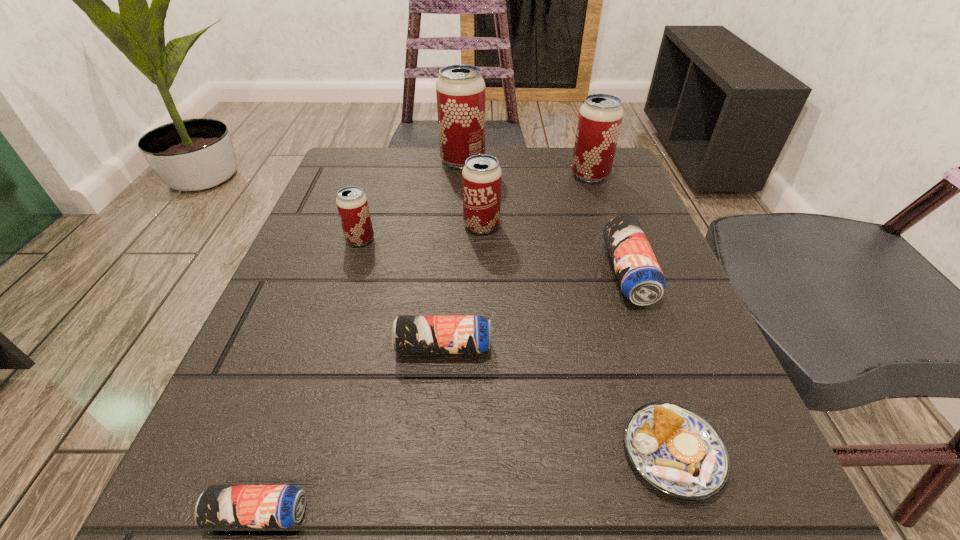
You are a GUI agent. You are given a task and a screenshot of the screen. Output one action in this format:
    pyautogui.click(x=<x>, y=<y>)
    Task: Click on the second blue beer can from right to left
    This screenshot has height=540, width=960.
    Given the screenshot: What is the action you would take?
    [x=410, y=334]

Where is `the sixth tallest object`? The image size is (960, 540). the sixth tallest object is located at coordinates (410, 334).

The height and width of the screenshot is (540, 960). Find the location of `brown pastry`. brown pastry is located at coordinates (677, 451).

This screenshot has height=540, width=960. I want to click on the nearest beer can, so click(x=220, y=506).

The height and width of the screenshot is (540, 960). Find the location of `the nearest blue beer can`. the nearest blue beer can is located at coordinates (220, 506).

This screenshot has width=960, height=540. I want to click on free location located 0.130m on the left of the tallest beer can, so click(384, 160).

At what (x,y) coordinates should I click in order to perform the action: click on free space located on the left of the second biggest red beer can. Please return your answer as a coordinate pair (x, y). The height and width of the screenshot is (540, 960). Looking at the image, I should click on (489, 175).

The width and height of the screenshot is (960, 540). Find the location of `vacant region located 0.090m on the left of the third tallest beer can`. vacant region located 0.090m on the left of the third tallest beer can is located at coordinates (417, 225).

Find the location of a particular element. Image resolution: width=960 pixels, height=540 pixels. free region located 0.120m on the back of the smallest red beer can is located at coordinates (374, 195).

Identify the location of vacant region located on the left of the farthest blue beer can. (537, 273).